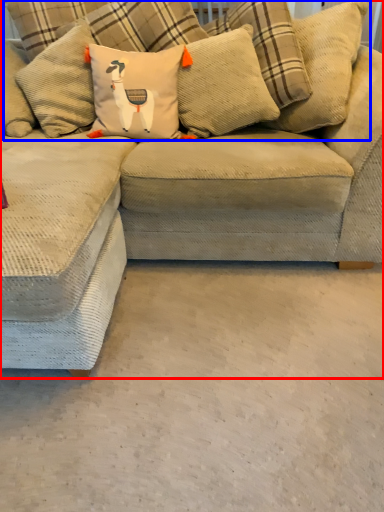
Question: Which of the following is the farthest to the observer, studio couch (highlighted by a red box) or pillow (highlighted by a blue box)?

Choices:
 (A) studio couch
 (B) pillow

Answer: (B)